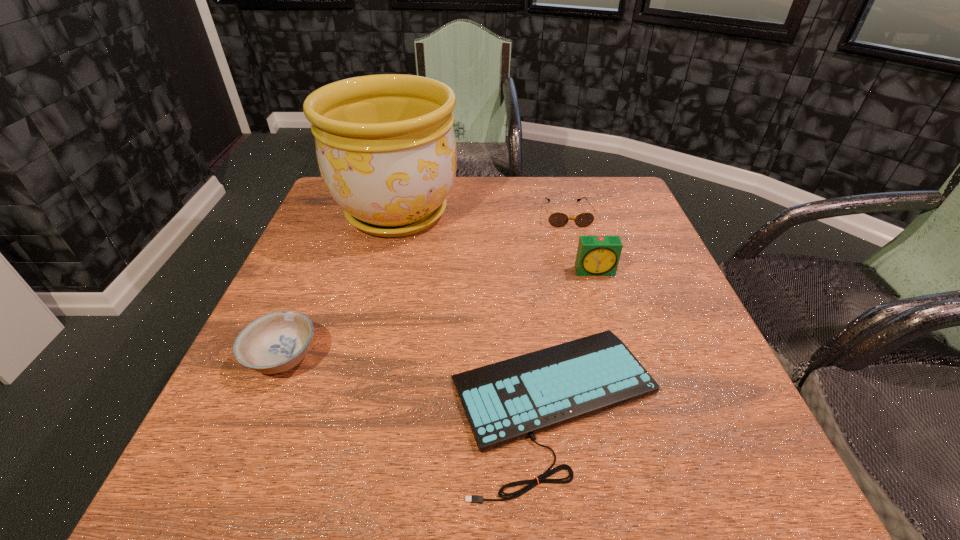
Find the location of a particular element. This screenshot has width=960, height=540. object that is the closest one to the fourth tallest object is located at coordinates (596, 255).